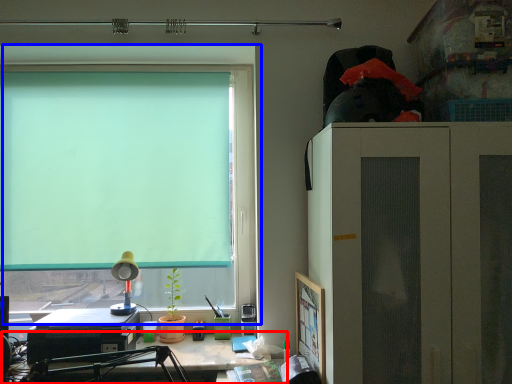
Question: Which object is further to the camera taking this photo, desk (highlighted by a red box) or window (highlighted by a blue box)?

Choices:
 (A) desk
 (B) window

Answer: (B)